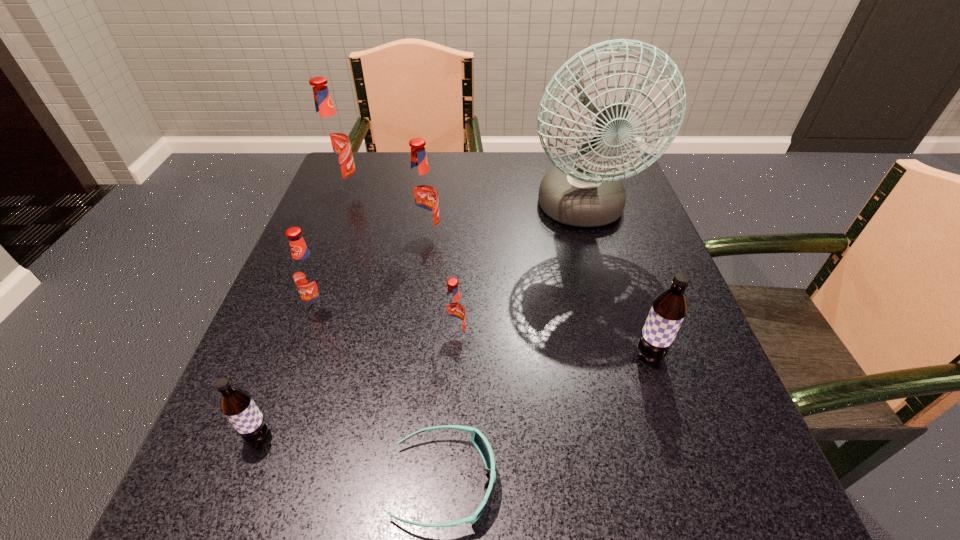
You are a GUI agent. You are given a task and a screenshot of the screen. Output one action in this format:
    pyautogui.click(x=<x>, y=<y>)
    Task: Click on the vacant position located on the left of the smallest red root beer
    
    Given the screenshot: What is the action you would take?
    pyautogui.click(x=398, y=337)

Image resolution: width=960 pixels, height=540 pixels. Find the location of `vacant space located on the back of the left brown root beer`. vacant space located on the back of the left brown root beer is located at coordinates (283, 371).

In order to click on vacant area situated on the front-facing side of the sunglasses in this screenshot , I will do `click(660, 481)`.

Identify the location of fan that is at the far edge. Image resolution: width=960 pixels, height=540 pixels. (593, 115).

Locate an element on the screen. This screenshot has width=960, height=540. root beer at the far edge is located at coordinates (332, 141).

Locate an element on the screen. object at the near edge is located at coordinates (478, 439).

Find the location of `fan positioned at the right edge`. fan positioned at the right edge is located at coordinates (593, 115).

Locate an element on the screen. This screenshot has width=960, height=540. root beer that is at the right edge is located at coordinates (669, 308).

Find the location of a particular element. This screenshot has width=960, height=540. object that is at the far left corner is located at coordinates (332, 141).

Where is `object located in the far right corner section of the desktop`? The width and height of the screenshot is (960, 540). object located in the far right corner section of the desktop is located at coordinates (593, 115).